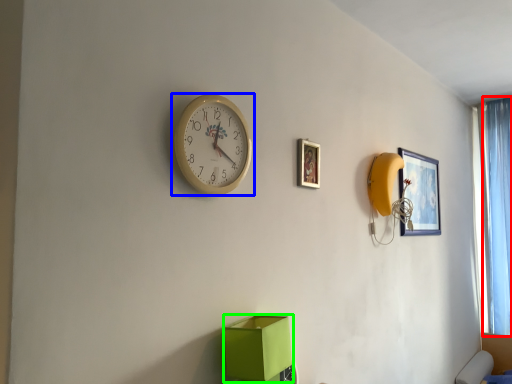
Question: Which is farther away from curtain (highlighted by a red box)? wall clock (highlighted by a blue box) or cardboard box (highlighted by a green box)?

Choices:
 (A) wall clock
 (B) cardboard box

Answer: (A)